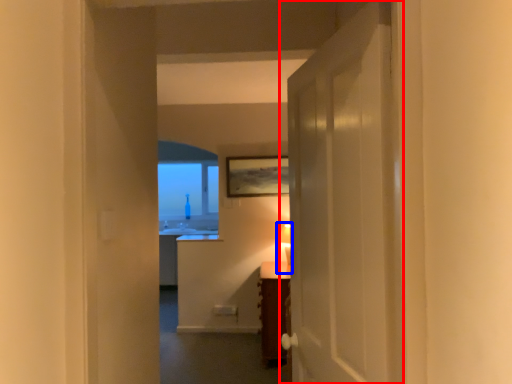
Question: Which object is closer to the camera taking this photo, door (highlighted by a red box) or table lamp (highlighted by a blue box)?

Choices:
 (A) door
 (B) table lamp

Answer: (A)